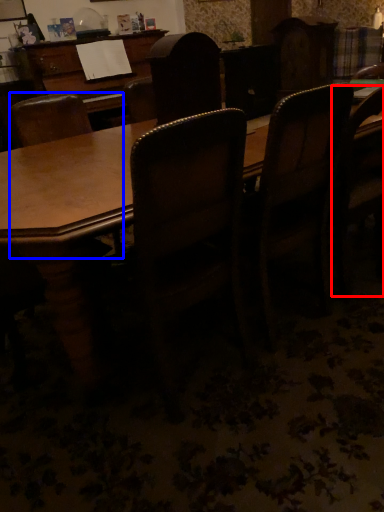
Question: Which object is closer to the camera taking this photo, chair (highlighted by a red box) or chair (highlighted by a blue box)?

Choices:
 (A) chair
 (B) chair

Answer: (B)